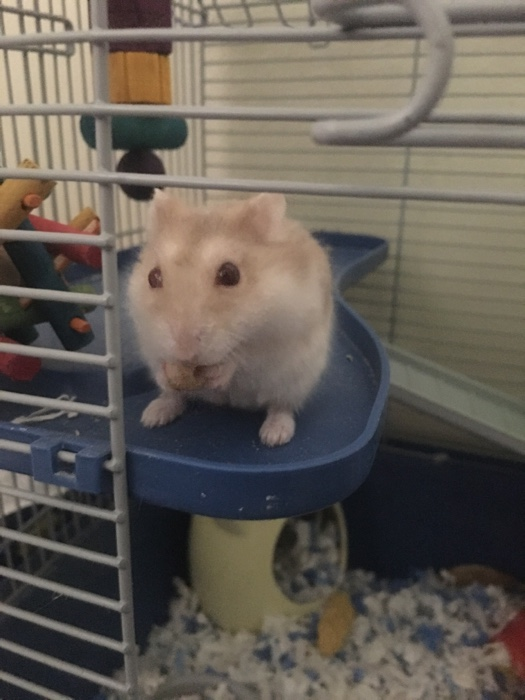
Where is `hanging toy`? The width and height of the screenshot is (525, 700). hanging toy is located at coordinates (150, 85), (149, 400).